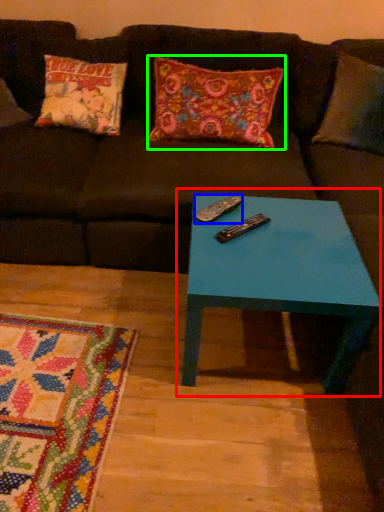
Question: Based on their relative distances, which object is farther from coffee table (highlighted by a red box)? Choose from remote (highlighted by a blue box) and pillow (highlighted by a green box).

Choices:
 (A) remote
 (B) pillow

Answer: (B)